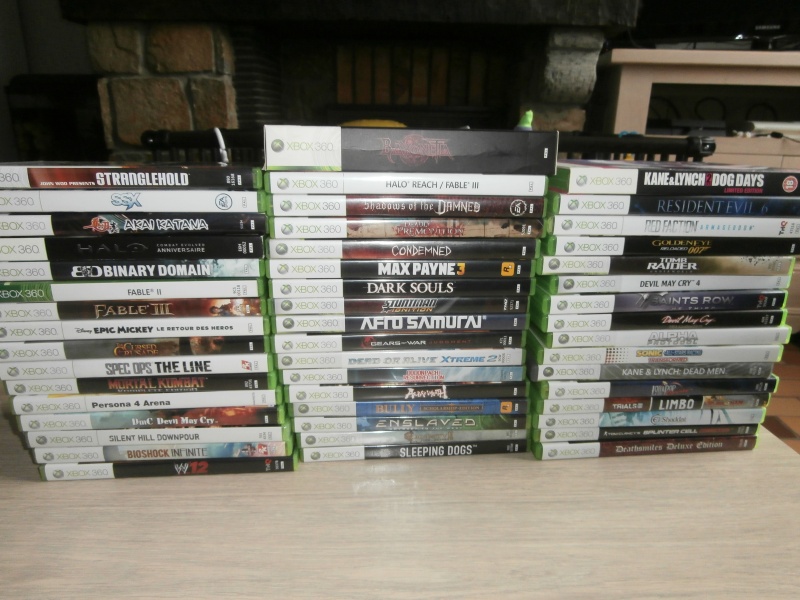
At what (x,y) coordinates should I click in order to perform the action: click on black line/divider between wood slates on back wall. Please return your answer as a coordinate pair (x, y). Looking at the image, I should click on (352, 79), (372, 88), (386, 88), (410, 88), (424, 91), (448, 91), (466, 93), (484, 91).